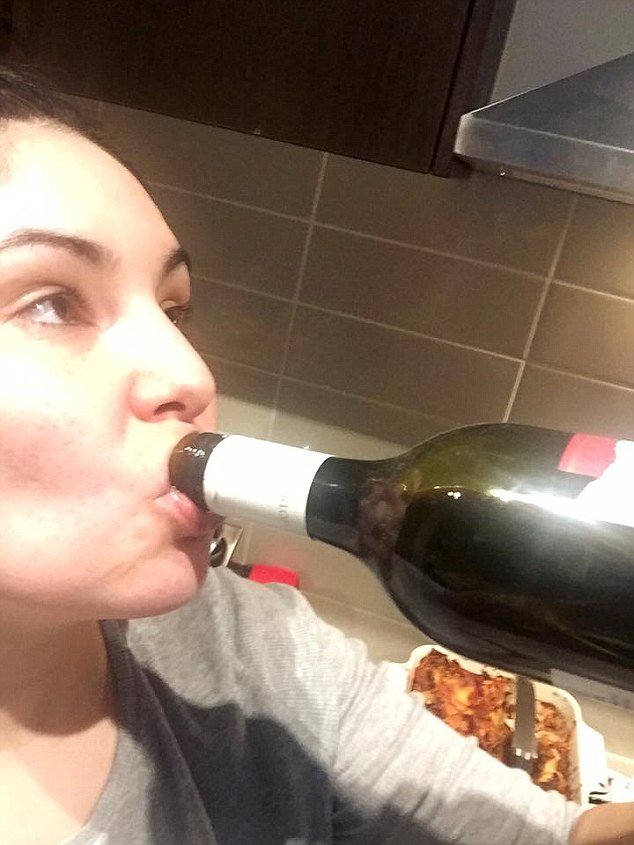
Locate an element on the screen. cabinet is located at coordinates [x=354, y=79].